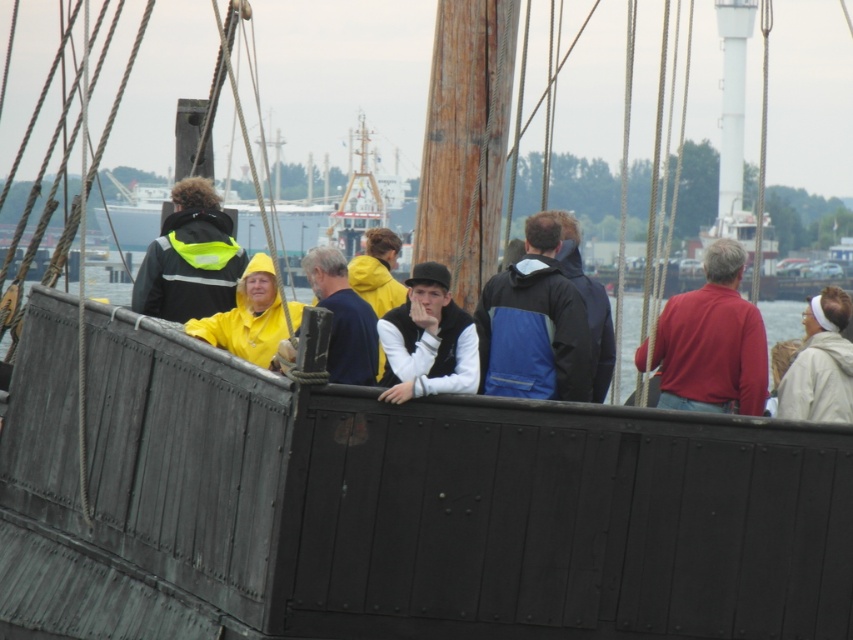
You are a sailor on the deck of the ship and you want to hang a small hook on the deck near the blue fabric jacket at center and matte red shirt at center. Since both are at the same position, which one should you place the hook below to avoid covering either clothing item?

The blue fabric jacket at center is above the matte red shirt at center, so placing the hook below the matte red shirt at center would avoid covering either clothing item.

You are standing on the deck of the ship and want to move from the point at coordinates point [514,340] to the point at coordinates point [669,376]. Which direction should you move relative to the ship?

You should move backward relative to the ship because point [514,340] is in front of point [669,376].